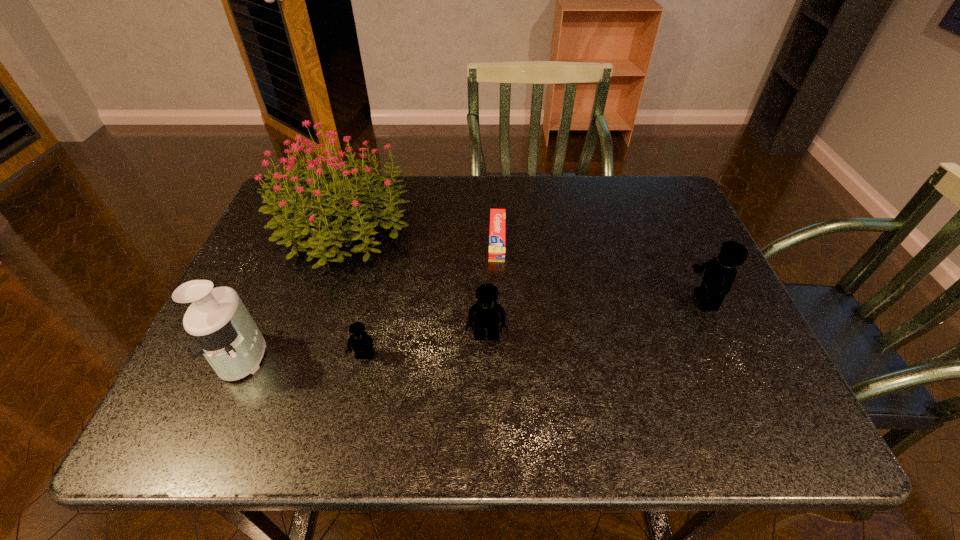
Locate an element on the screen. The image size is (960, 540). bouquet located in the left edge section of the desktop is located at coordinates (298, 210).

This screenshot has height=540, width=960. Find the location of `juicer located at the left edge`. juicer located at the left edge is located at coordinates (225, 333).

Find the location of a particular element. object that is at the right edge is located at coordinates (720, 272).

Where is `object that is at the far left corner`? object that is at the far left corner is located at coordinates (298, 210).

I want to click on object that is at the near left corner, so click(x=225, y=333).

In the image, there is a desktop. Where is `free space at the far edge`? The height and width of the screenshot is (540, 960). free space at the far edge is located at coordinates (480, 195).

In the image, there is a desktop. At what (x,y) coordinates should I click in order to perform the action: click on vacant space at the near edge. Please return your answer as a coordinate pair (x, y). Looking at the image, I should click on (304, 393).

Locate an element on the screen. The width and height of the screenshot is (960, 540). vacant area at the left edge of the desktop is located at coordinates (277, 271).

I want to click on vacant space at the right edge, so click(711, 356).

Image resolution: width=960 pixels, height=540 pixels. In order to click on free space at the near left corner of the desktop in this screenshot , I will do `click(259, 377)`.